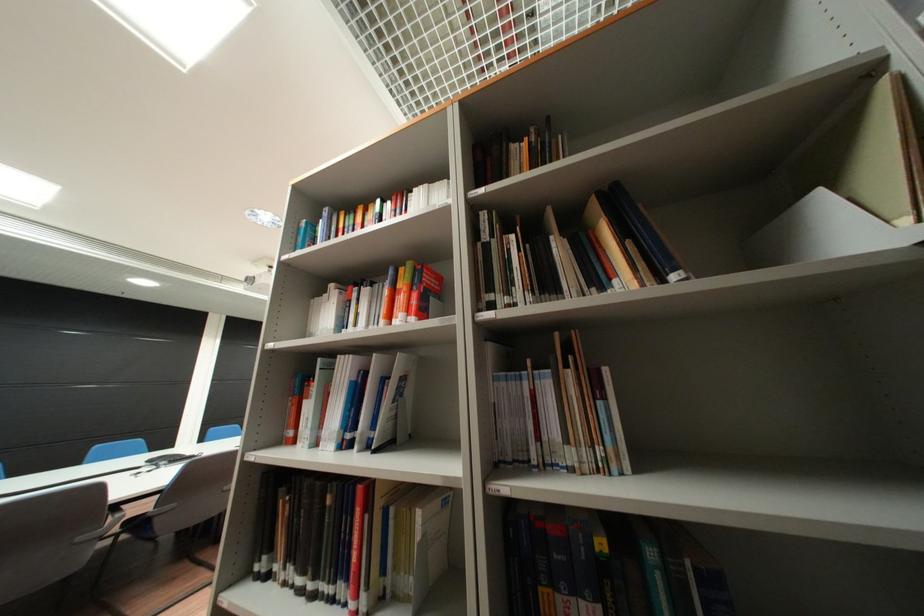
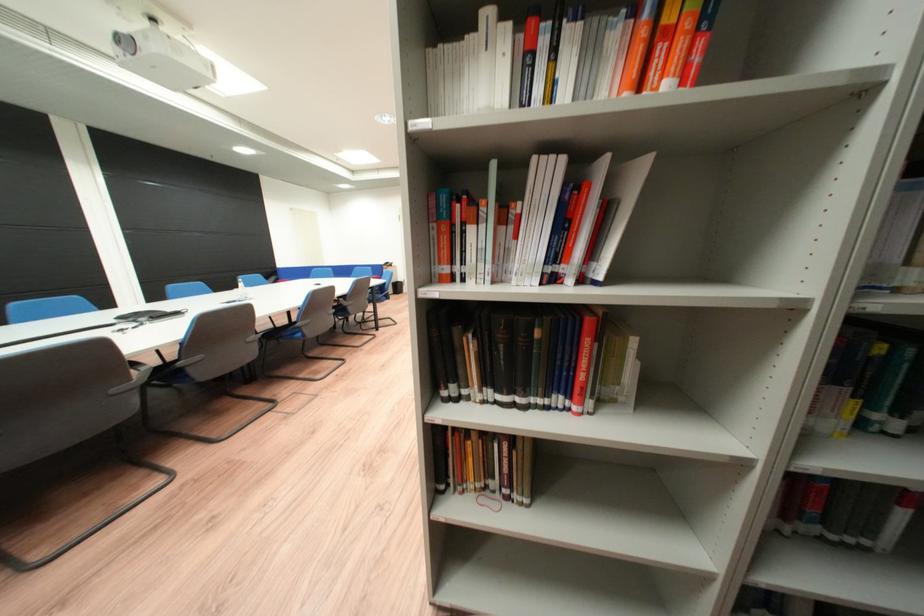
Question: Based on the continuous images, in which direction is the camera rotating? Reply with the corresponding letter.

Choices:
 (A) Left
 (B) Right
 (C) Up
 (D) Down

Answer: (D)